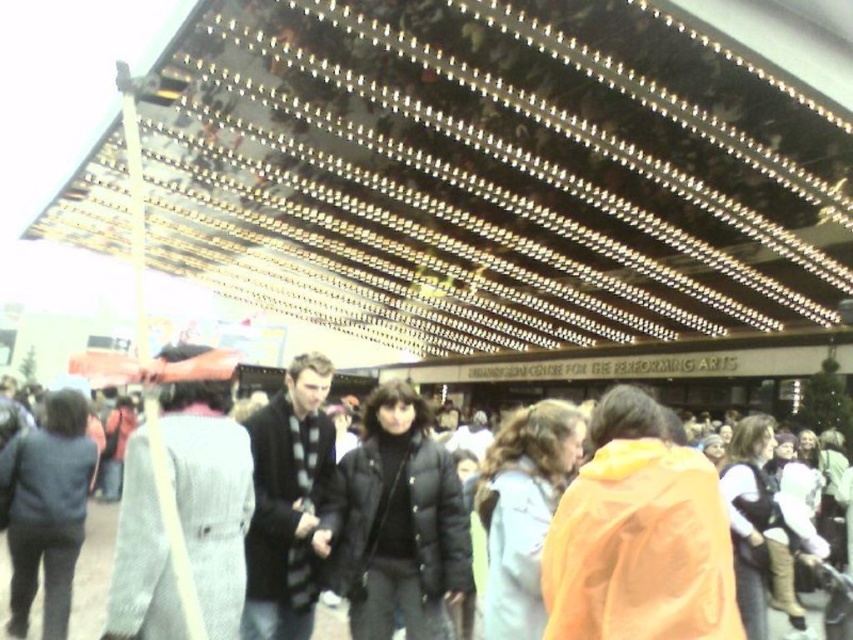
You are attending an event at the Center for the Performing Arts and notice two attendees wearing a black knit sweater at center and a matte black jacket at center. Which of these two items of clothing appears narrower when viewed from the front?

The black knit sweater at center appears narrower than the matte black jacket at center when viewed from the front because it is thinner.

You are attending an event at the Center for the Performing Arts and notice two attendees wearing a black knit sweater at center and a matte black jacket at center. Which piece of clothing is positioned higher on their bodies?

The black knit sweater at center is positioned higher than the matte black jacket at center.